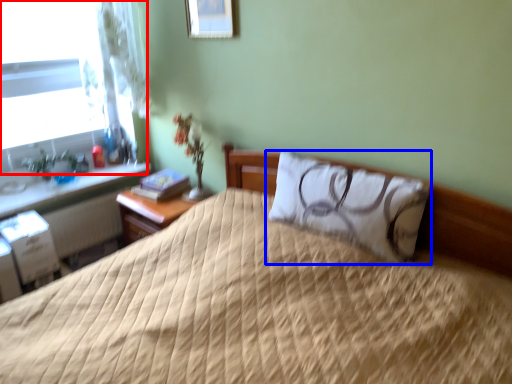
Question: Among these objects, which one is farthest to the camera, window (highlighted by a red box) or pillow (highlighted by a blue box)?

Choices:
 (A) window
 (B) pillow

Answer: (A)